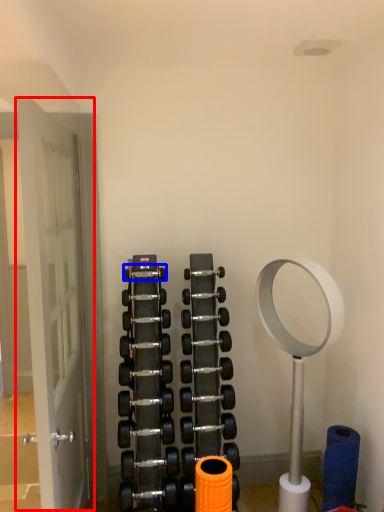
Question: Which point is further to the camera, door (highlighted by a red box) or dumbbell (highlighted by a blue box)?

Choices:
 (A) door
 (B) dumbbell

Answer: (B)